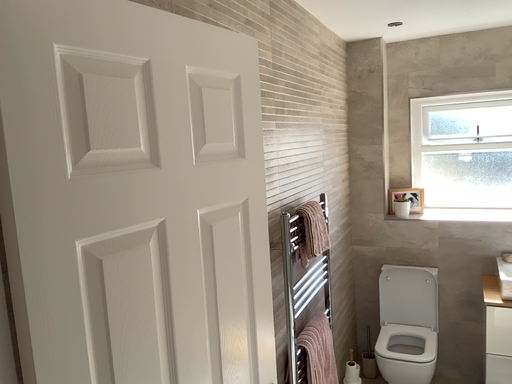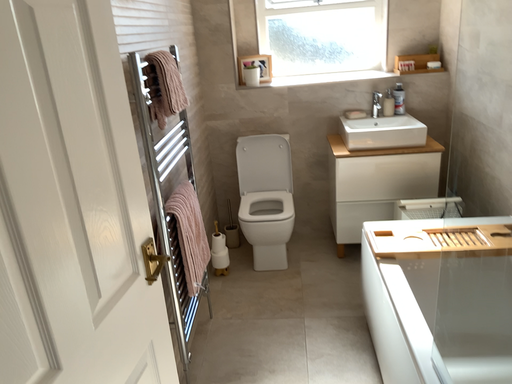
Question: How did the camera likely rotate when shooting the video?

Choices:
 (A) rotated downward
 (B) rotated upward

Answer: (A)